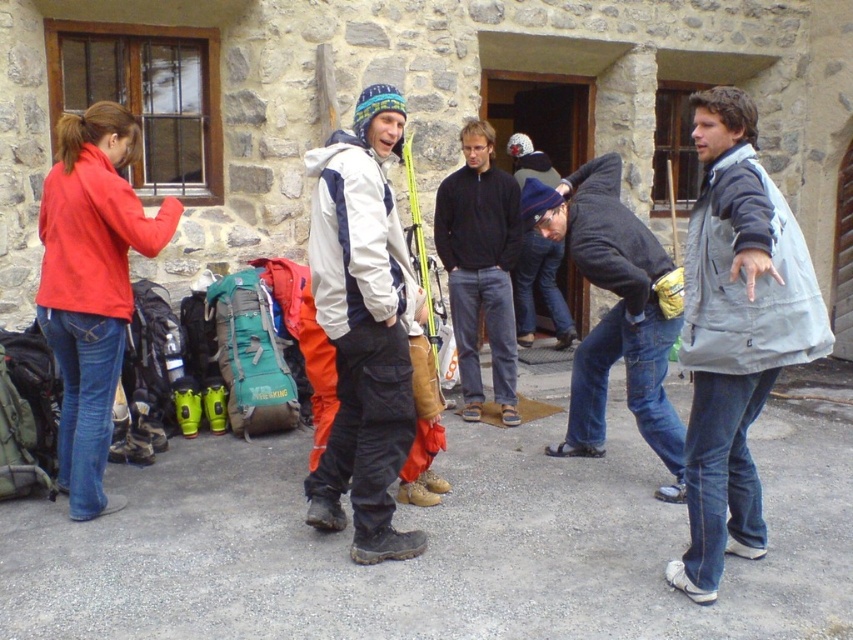
You are organizing a winter event and need to arrange participants based on their clothing. If you see the white matte jacket at center and the dark blue knit hat at center, which clothing item is located to the left?

The white matte jacket at center is positioned on the left side of the dark blue knit hat at center, so the white matte jacket at center is located to the left.